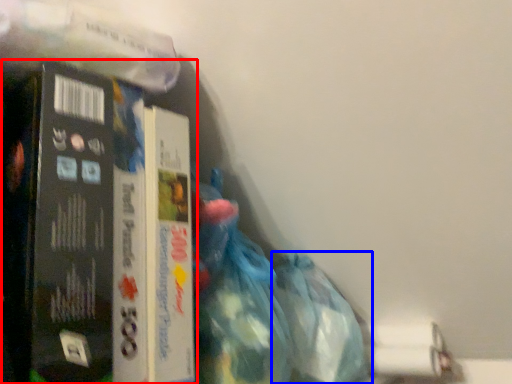
Question: Which object is closer to the camera taking this photo, book (highlighted by a red box) or plastic bag (highlighted by a blue box)?

Choices:
 (A) book
 (B) plastic bag

Answer: (A)